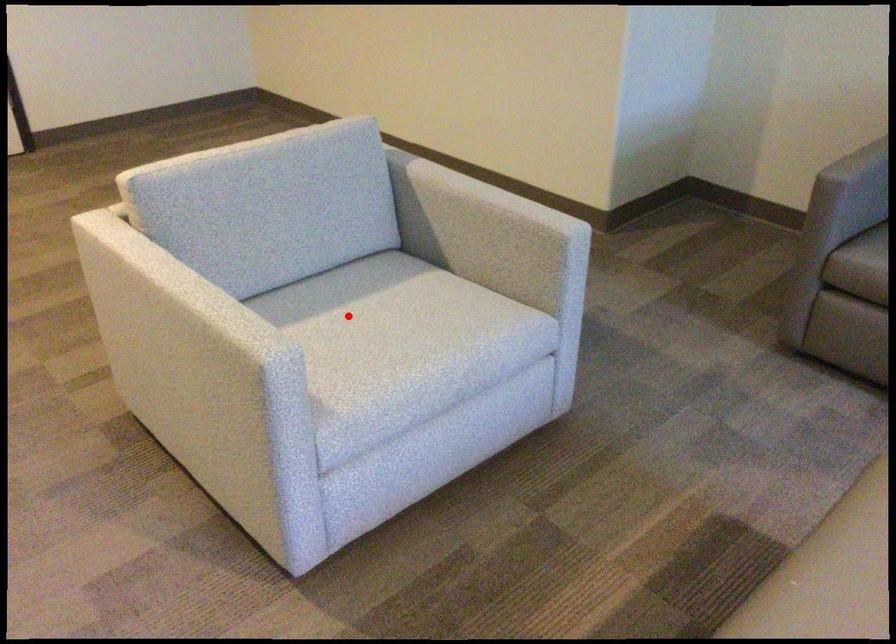
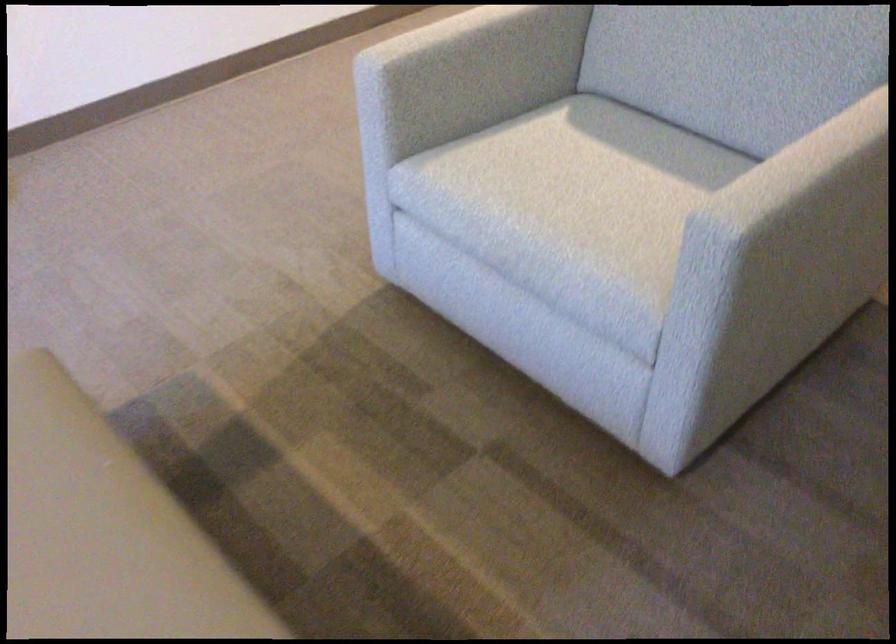
Question: I am providing you with two images of the same scene from different viewpoints. Given a red point in image1, look at the same physical point in image2. Is it:

Choices:
 (A) Closer to the viewpoint
 (B) Farther from the viewpoint

Answer: (A)